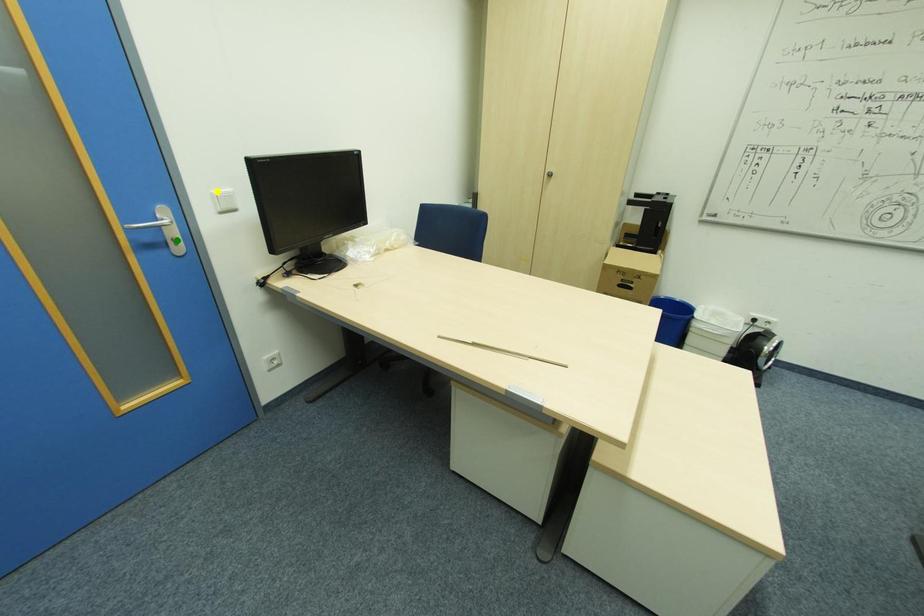
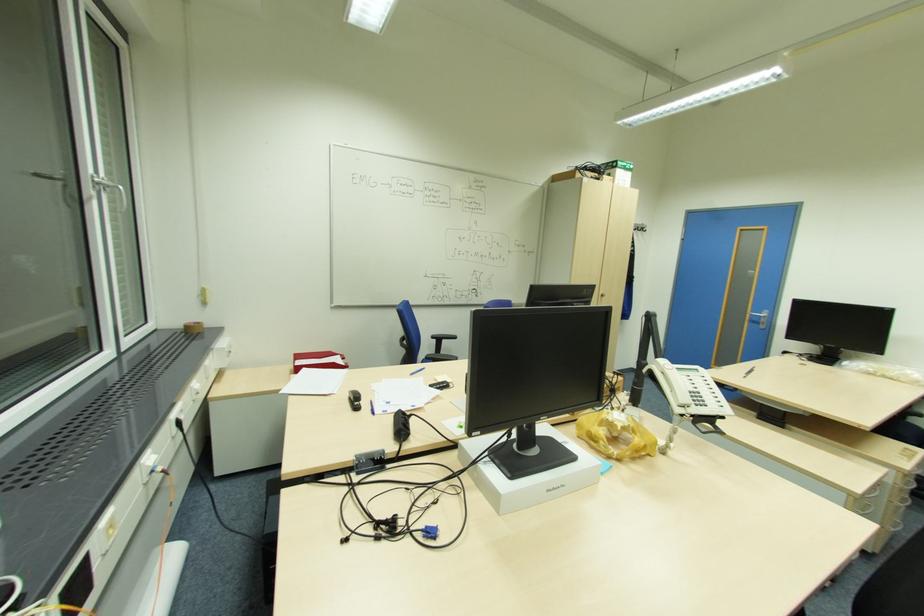
I am providing you with two images of the same scene from different viewpoints. Three points are marked in image1. Which point corresponds to a part or object that is occluded in image2?In image1, three points are marked. Which of them correspond to a part or object that is occluded in image2?Among the three points shown in image1, which one corresponds to a part or object that is no longer visible due to occlusion in image2?

yellow point cannot be seen in image2.